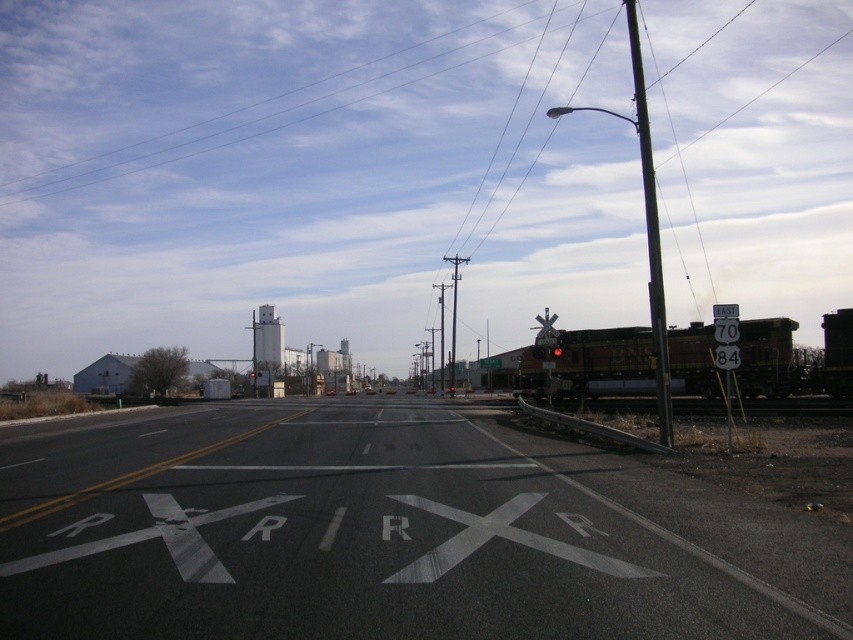
Question: Which object appears closest to the camera in this image?

Choices:
 (A) white plastic sign at right
 (B) brown textured train at right
 (C) red glass traffic light at center

Answer: (B)

Question: Which of the following is the closest to the observer?

Choices:
 (A) red glass traffic light at center
 (B) white plastic sign at right
 (C) white asphalt road at center

Answer: (C)

Question: Considering the relative positions of white plastic sign at right and red glass traffic light at center in the image provided, where is white plastic sign at right located with respect to red glass traffic light at center?

Choices:
 (A) right
 (B) left

Answer: (A)

Question: Which object is the closest to the white asphalt road at center?

Choices:
 (A) metallic pole at right
 (B) white plastic sign at right
 (C) red glass traffic light at center
 (D) metal at right

Answer: (D)

Question: Does brown textured train at right appear over white plastic sign at right?

Choices:
 (A) yes
 (B) no

Answer: (B)

Question: Does white plastic sign at right appear on the right side of metal at right?

Choices:
 (A) yes
 (B) no

Answer: (A)